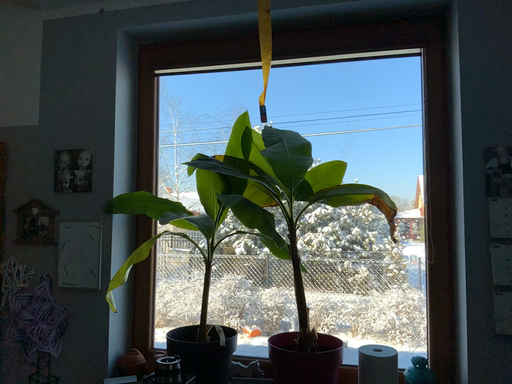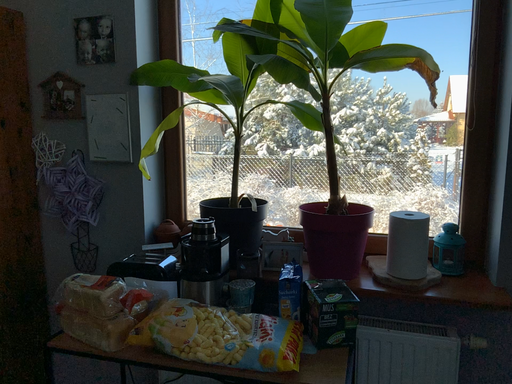
Question: How did the camera likely rotate when shooting the video?

Choices:
 (A) rotated downward
 (B) rotated upward

Answer: (A)